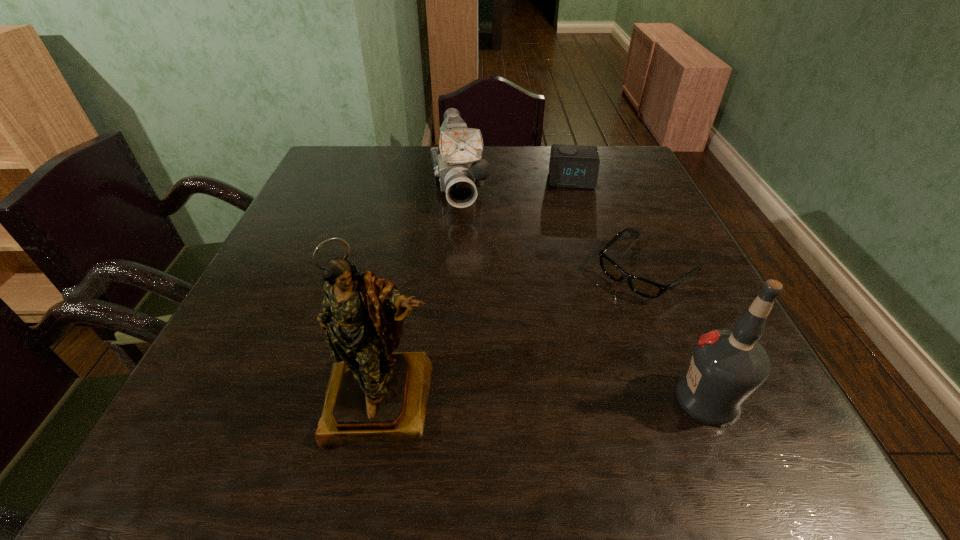
Where is `vacant space located 0.190m on the front-facing side of the alarm clock`? The height and width of the screenshot is (540, 960). vacant space located 0.190m on the front-facing side of the alarm clock is located at coordinates (575, 231).

Image resolution: width=960 pixels, height=540 pixels. What are the coordinates of `blank area located on the front-facing side of the alarm clock` in the screenshot? It's located at (573, 208).

Locate an element on the screen. vacant region located on the front-facing side of the camcorder is located at coordinates (467, 249).

Identify the location of free spot located 0.360m on the front-facing side of the camcorder. (479, 323).

I want to click on free space located 0.180m on the front-facing side of the camcorder, so click(x=468, y=263).

Locate an element on the screen. This screenshot has height=540, width=960. vacant position located on the front-facing side of the third nearest object is located at coordinates (570, 336).

The width and height of the screenshot is (960, 540). What are the coordinates of `free spot located on the front-facing side of the third nearest object` in the screenshot? It's located at (515, 384).

You are a GUI agent. You are given a task and a screenshot of the screen. Output one action in this format:
    pyautogui.click(x=<x>, y=<y>)
    Task: Click on the free space located 0.060m on the front-facing side of the third nearest object
    The height and width of the screenshot is (540, 960).
    Given the screenshot: What is the action you would take?
    pyautogui.click(x=601, y=309)

Where is `alarm clock present at the far edge`? This screenshot has width=960, height=540. alarm clock present at the far edge is located at coordinates (571, 166).

Where is `camcorder present at the far edge`? This screenshot has width=960, height=540. camcorder present at the far edge is located at coordinates (458, 167).